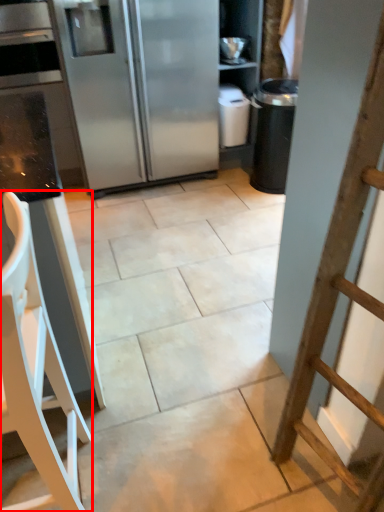
Question: From the image's perspective, what is the correct spatial positioning of furniture (annotated by the red box) in reference to refrigerator?

Choices:
 (A) above
 (B) below

Answer: (B)